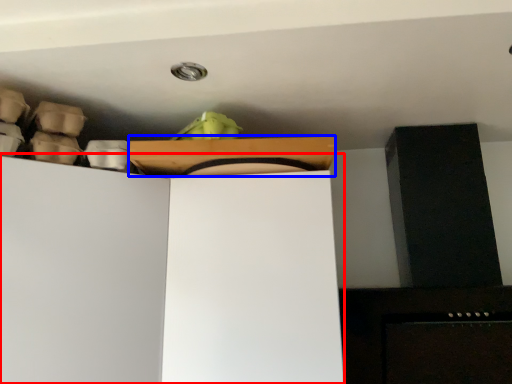
Question: Which object is further to the camera taking this photo, cabinetry (highlighted by a red box) or cardboard box (highlighted by a blue box)?

Choices:
 (A) cabinetry
 (B) cardboard box

Answer: (B)